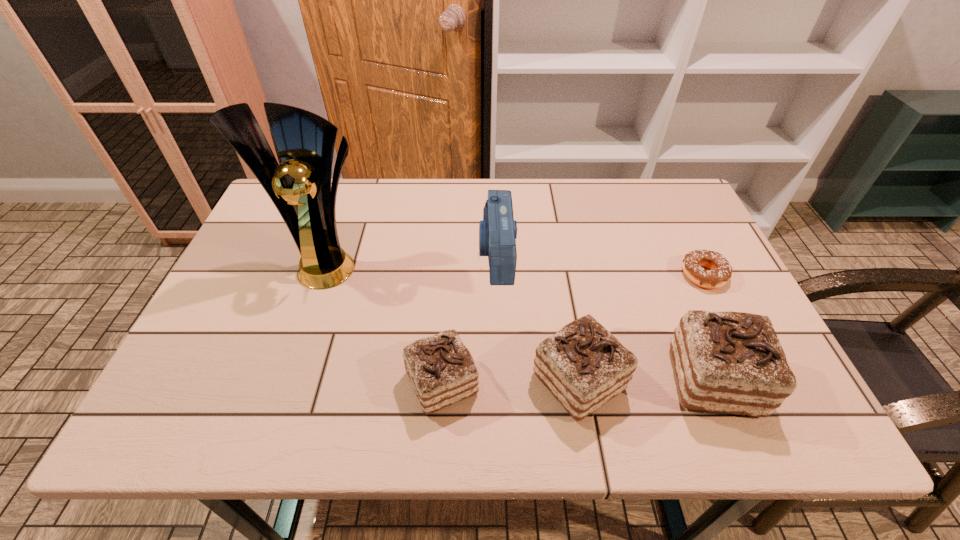
This screenshot has height=540, width=960. I want to click on the leftmost chocolate cake, so click(x=441, y=370).

Locate an element on the screen. the fifth tallest object is located at coordinates (441, 370).

Find the location of `the second shortest chocolate cake`. the second shortest chocolate cake is located at coordinates (583, 365).

At what (x,y) coordinates should I click in order to perform the action: click on the third object from right to left. Please return your answer as a coordinate pair (x, y). Image resolution: width=960 pixels, height=540 pixels. Looking at the image, I should click on click(583, 365).

This screenshot has width=960, height=540. In order to click on the rightmost chocolate cake in this screenshot , I will do `click(733, 362)`.

The width and height of the screenshot is (960, 540). Find the location of `doughnut`. doughnut is located at coordinates (720, 272).

Where is `the leftmost object`? This screenshot has width=960, height=540. the leftmost object is located at coordinates (300, 187).

Where is `the tallest object`? The width and height of the screenshot is (960, 540). the tallest object is located at coordinates (300, 187).

Image resolution: width=960 pixels, height=540 pixels. What are the coordinates of `camera` in the screenshot? It's located at (498, 231).

The image size is (960, 540). What are the coordinates of `vacant region located on the back of the fifth tallest object` in the screenshot? It's located at (452, 234).